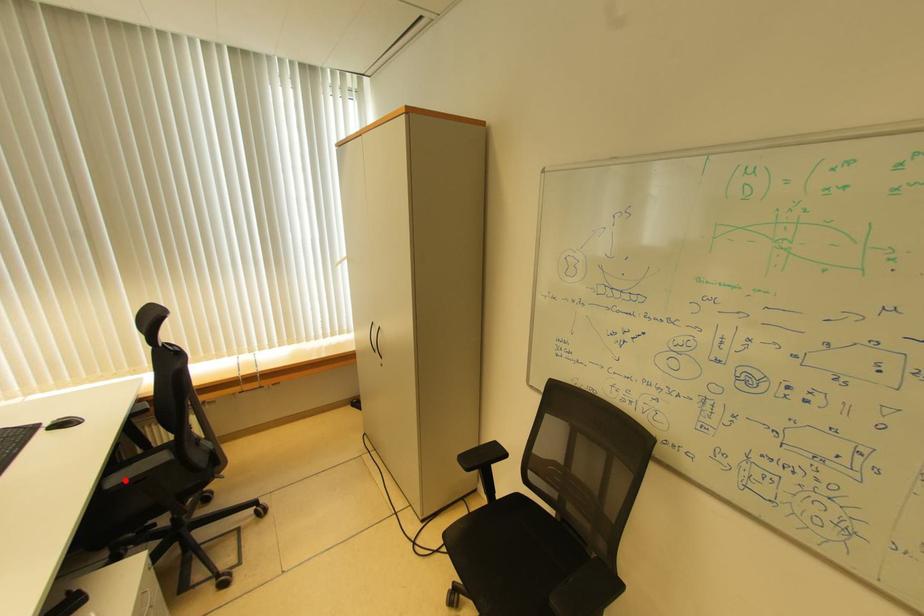
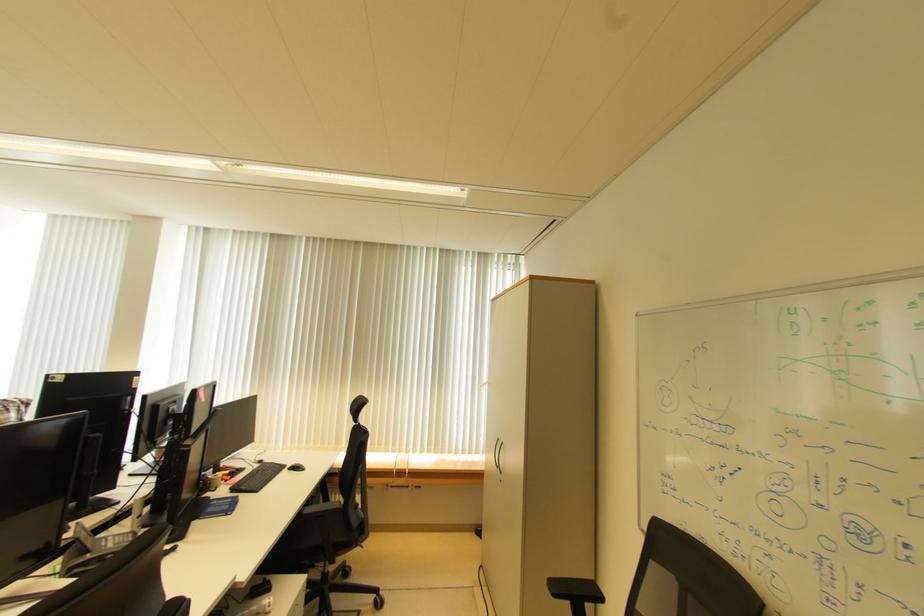
Question: I am providing you with two images of the same scene from different viewpoints. In image1, a red point is highlighted. Considering the same 3D point in image2, which of the following is correct?

Choices:
 (A) It is closer
 (B) It is farther

Answer: (A)